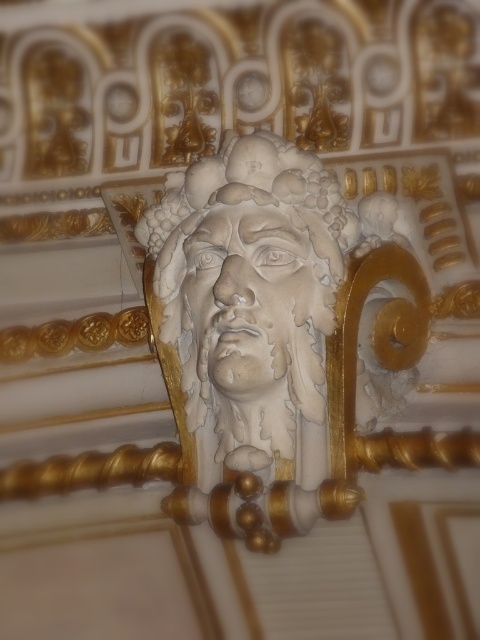
In the scene shown: You are an artisan tasked with placing a golden frame around the white stone sculpture at center and the white stone face at center. The frame must be exactly 2 centimeters away from each object. Is this possible given their current spacing?

The distance between the white stone sculpture at center and the white stone face at center is 2.35 centimeters. Since the required spacing for the frame is 2 centimeters from each, the total required space would be 4 centimeters. However, the actual distance is only 2.35 centimeters, which is insufficient. Therefore, placing the frame as specified is not possible.

You are an interior designer planning to install a spotlight above the white stone sculpture at center and the white stone face at center. Which object should the spotlight be placed above to ensure it shines directly on the object below?

The white stone sculpture at center is positioned under the white stone face at center, so the spotlight should be placed above the white stone face at center to shine directly on the white stone sculpture at center.